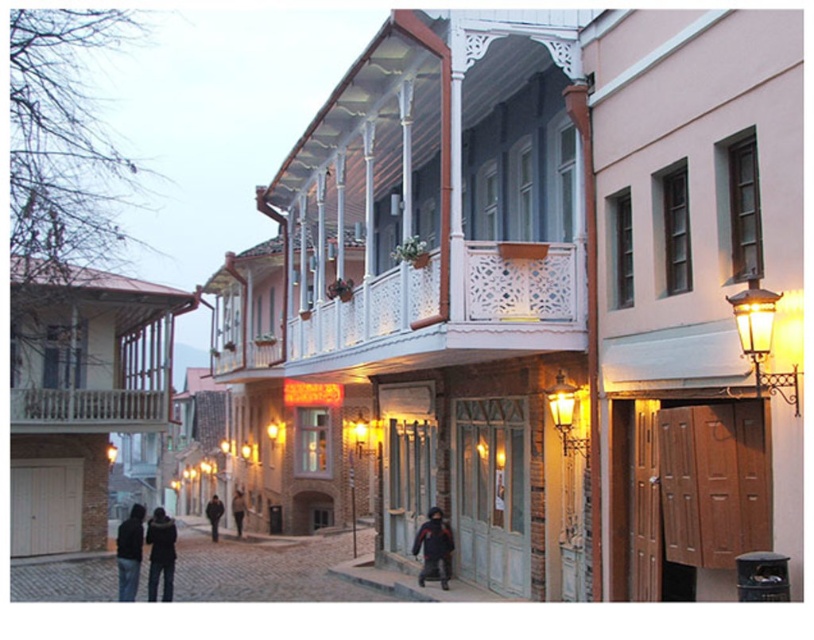
You are an architect analyzing the historic street scene. You notice the white wooden balcony at upper center and the golden brass streetlamp at right. Which object would require more materials to construct, based on their size?

The white wooden balcony at upper center would require more materials to construct since it is bigger than the golden brass streetlamp at right.

You are standing on the cobblestone street at lower left and want to reach the dark blue jacket at center. Which direction should you move to get closer to the jacket?

You should move upward because the cobblestone street at lower left is below the dark blue jacket at center, so moving upward will bring you closer to the jacket.